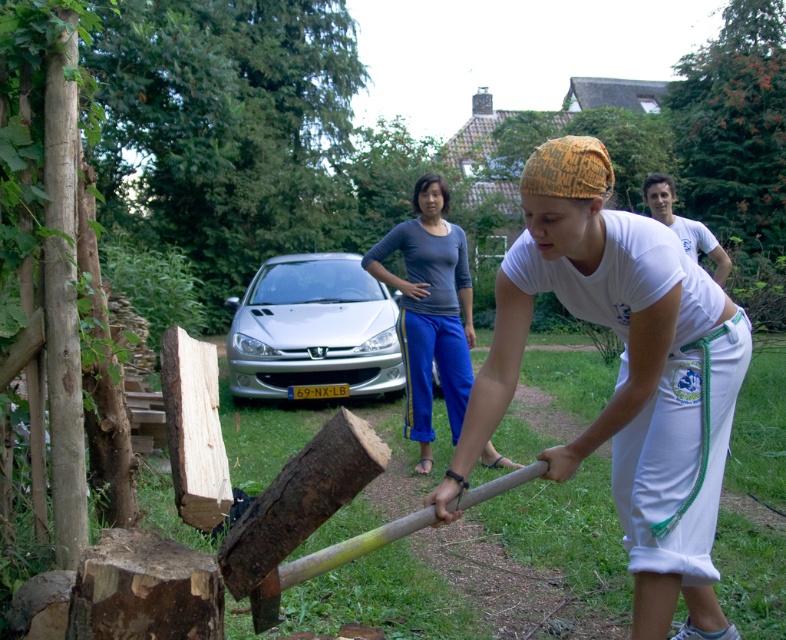
Question: Can you confirm if silver metallic car at center is positioned to the right of dark gray cotton shirt at center?

Choices:
 (A) no
 (B) yes

Answer: (A)

Question: Which of the following is the farthest from the observer?

Choices:
 (A) (325, 266)
 (B) (498, 458)

Answer: (A)

Question: Does silver metallic car at center have a larger size compared to dark gray cotton shirt at center?

Choices:
 (A) no
 (B) yes

Answer: (B)

Question: Is silver metallic car at center wider than dark gray cotton shirt at center?

Choices:
 (A) no
 (B) yes

Answer: (B)